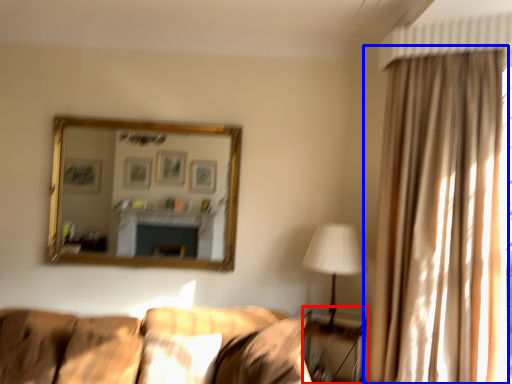
Question: Which object appears farthest to the camera in this image, table (highlighted by a red box) or curtain (highlighted by a blue box)?

Choices:
 (A) table
 (B) curtain

Answer: (A)